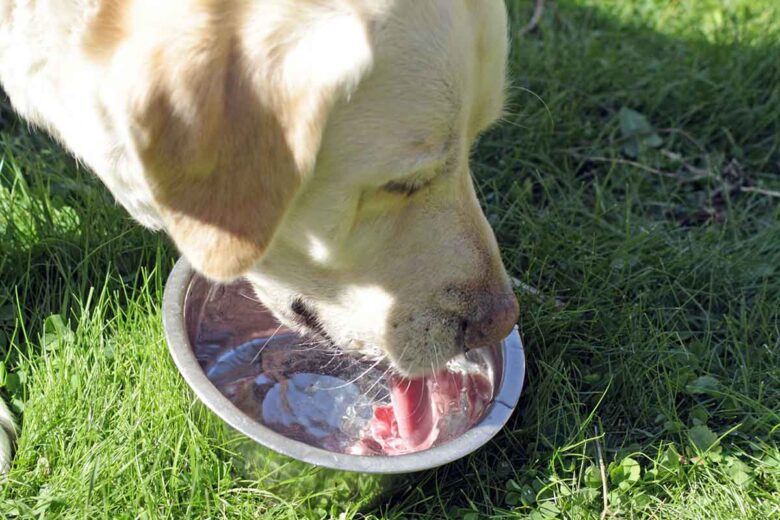
I want to click on silver metallic bowl, so click(x=214, y=397).